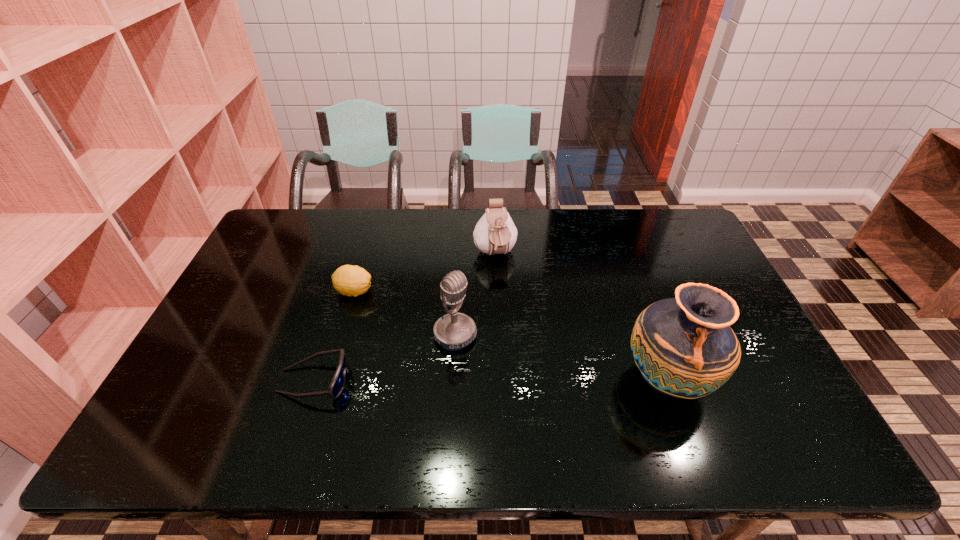
The image size is (960, 540). I want to click on blank space that satisfies the following two spatial constraints: 1. on the front side of the lemon; 2. on the right side of the pottery, so click(x=327, y=379).